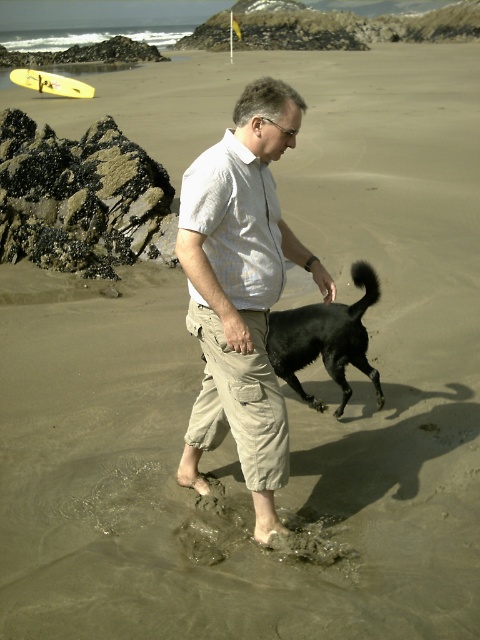
Question: Observing the image, what is the correct spatial positioning of black matte dog at lower center in reference to clear water at upper left?

Choices:
 (A) right
 (B) left

Answer: (A)

Question: Which point appears closest to the camera in this image?

Choices:
 (A) (277, 326)
 (B) (134, 28)

Answer: (A)

Question: Considering the relative positions of light beige cotton shirt at center and clear water at upper left in the image provided, where is light beige cotton shirt at center located with respect to clear water at upper left?

Choices:
 (A) left
 (B) right

Answer: (B)

Question: Which of these objects is positioned closest to the clear water at upper left?

Choices:
 (A) light beige cotton shirt at center
 (B) black matte dog at lower center

Answer: (B)

Question: Which object appears farthest from the camera in this image?

Choices:
 (A) black matte dog at lower center
 (B) light beige cotton shirt at center
 (C) clear water at upper left

Answer: (C)

Question: Is black matte dog at lower center smaller than clear water at upper left?

Choices:
 (A) yes
 (B) no

Answer: (A)